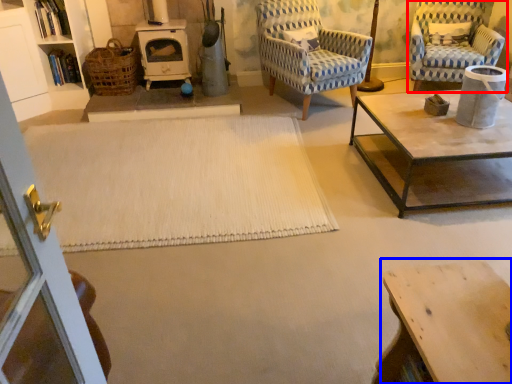
Question: Among these objects, which one is nearest to the camera, chair (highlighted by a red box) or table (highlighted by a blue box)?

Choices:
 (A) chair
 (B) table

Answer: (B)